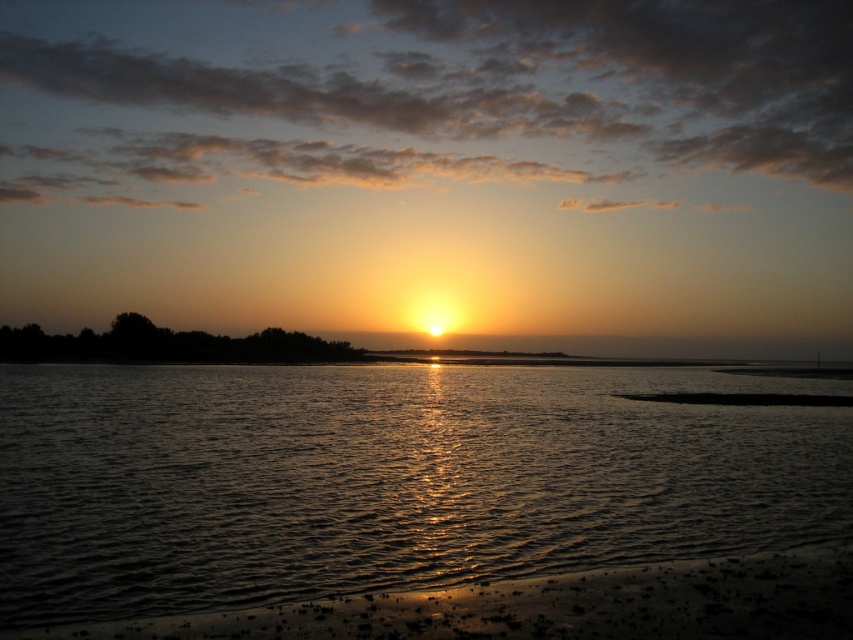
Question: Can you confirm if glistening water at center is thinner than sandy shore at lower center?

Choices:
 (A) no
 (B) yes

Answer: (A)

Question: Considering the relative positions of glistening water at center and sandy shore at lower center in the image provided, where is glistening water at center located with respect to sandy shore at lower center?

Choices:
 (A) above
 (B) below

Answer: (B)

Question: In this image, where is glistening water at center located relative to sandy shore at lower center?

Choices:
 (A) right
 (B) left

Answer: (A)